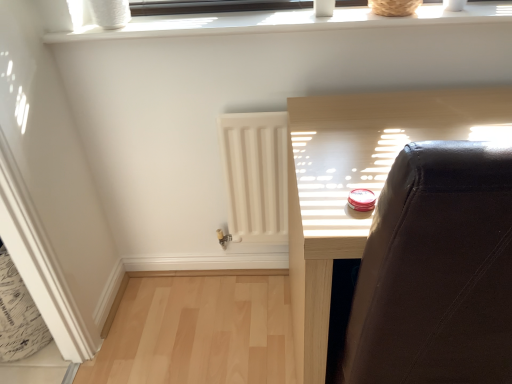
Question: Should I look upward or downward to see dark brown wood window frame at upper center, which appears as the 2th window frame when ordered from the bottom?

Choices:
 (A) down
 (B) up

Answer: (B)

Question: Should I look upward or downward to see white matte radiator at center?

Choices:
 (A) down
 (B) up

Answer: (B)

Question: Would you say dark brown wood window frame at upper center, which appears as the 2th window frame when ordered from the bottom, is part of matte black chair at upper right's contents?

Choices:
 (A) no
 (B) yes

Answer: (A)

Question: Is matte black chair at upper right facing away from dark brown wood window frame at upper center, the 1th window frame when ordered from top to bottom?

Choices:
 (A) no
 (B) yes

Answer: (A)

Question: From a real-world perspective, does matte black chair at upper right sit lower than dark brown wood window frame at upper center, the 1th window frame when ordered from top to bottom?

Choices:
 (A) yes
 (B) no

Answer: (A)

Question: Considering the relative sizes of matte black chair at upper right and dark brown wood window frame at upper center, which appears as the 2th window frame when ordered from the bottom, in the image provided, is matte black chair at upper right thinner than dark brown wood window frame at upper center, which appears as the 2th window frame when ordered from the bottom,?

Choices:
 (A) no
 (B) yes

Answer: (A)

Question: Would you say matte black chair at upper right is a long distance from dark brown wood window frame at upper center, which appears as the 2th window frame when ordered from the bottom?

Choices:
 (A) yes
 (B) no

Answer: (B)

Question: Is matte black chair at upper right closer to camera compared to dark brown wood window frame at upper center, which appears as the 2th window frame when ordered from the bottom?

Choices:
 (A) yes
 (B) no

Answer: (A)

Question: Does white matte radiator at center appear on the right side of white plastic window frame at upper center, the 2th window frame from the top?

Choices:
 (A) no
 (B) yes

Answer: (A)

Question: Can you confirm if white matte radiator at center is thinner than white plastic window frame at upper center, which is the first window frame from bottom to top?

Choices:
 (A) yes
 (B) no

Answer: (A)

Question: From the image's perspective, is white matte radiator at center under white plastic window frame at upper center, which is the first window frame from bottom to top?

Choices:
 (A) yes
 (B) no

Answer: (A)

Question: From a real-world perspective, is white matte radiator at center located beneath white plastic window frame at upper center, which is the first window frame from bottom to top?

Choices:
 (A) no
 (B) yes

Answer: (B)

Question: Is white matte radiator at center facing towards white plastic window frame at upper center, the 2th window frame from the top?

Choices:
 (A) yes
 (B) no

Answer: (B)

Question: Can you confirm if white matte radiator at center is positioned to the left of white plastic window frame at upper center, the 2th window frame from the top?

Choices:
 (A) yes
 (B) no

Answer: (A)

Question: Does white matte radiator at center have a greater height compared to dark brown wood window frame at upper center, the 1th window frame when ordered from top to bottom?

Choices:
 (A) yes
 (B) no

Answer: (A)